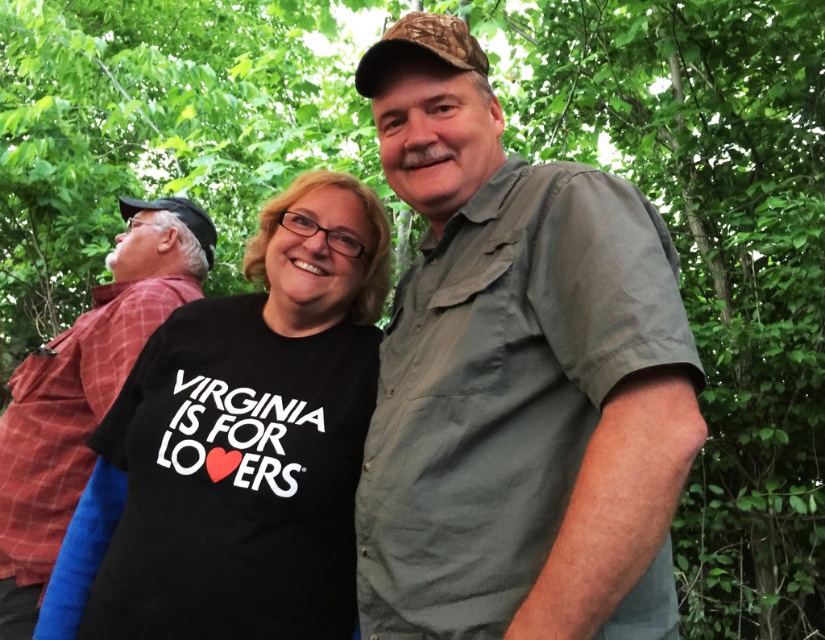
Question: Which point is closer to the camera taking this photo?

Choices:
 (A) (8, 420)
 (B) (357, 356)

Answer: (B)

Question: Which of the following is the closest to the observer?

Choices:
 (A) (277, 480)
 (B) (634, 401)

Answer: (B)

Question: Does matte gray shirt at center have a lesser width compared to black matte t-shirt at center?

Choices:
 (A) no
 (B) yes

Answer: (B)

Question: Considering the relative positions of matte gray shirt at center and red plaid shirt at left in the image provided, where is matte gray shirt at center located with respect to red plaid shirt at left?

Choices:
 (A) right
 (B) left

Answer: (A)

Question: Is matte gray shirt at center closer to camera compared to red plaid shirt at left?

Choices:
 (A) yes
 (B) no

Answer: (A)

Question: Which of the following is the farthest from the observer?

Choices:
 (A) black matte t-shirt at center
 (B) red plaid shirt at left

Answer: (B)